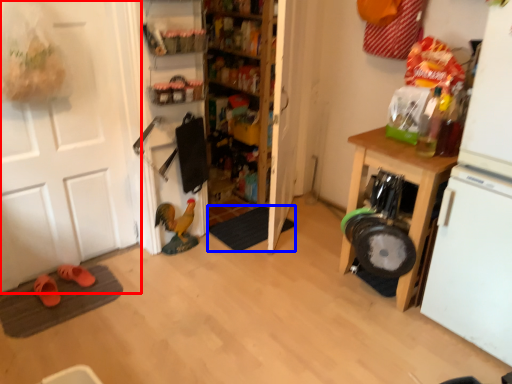
Question: Which object appears closest to the camera in this image, door (highlighted by a red box) or doormat (highlighted by a blue box)?

Choices:
 (A) door
 (B) doormat

Answer: (A)